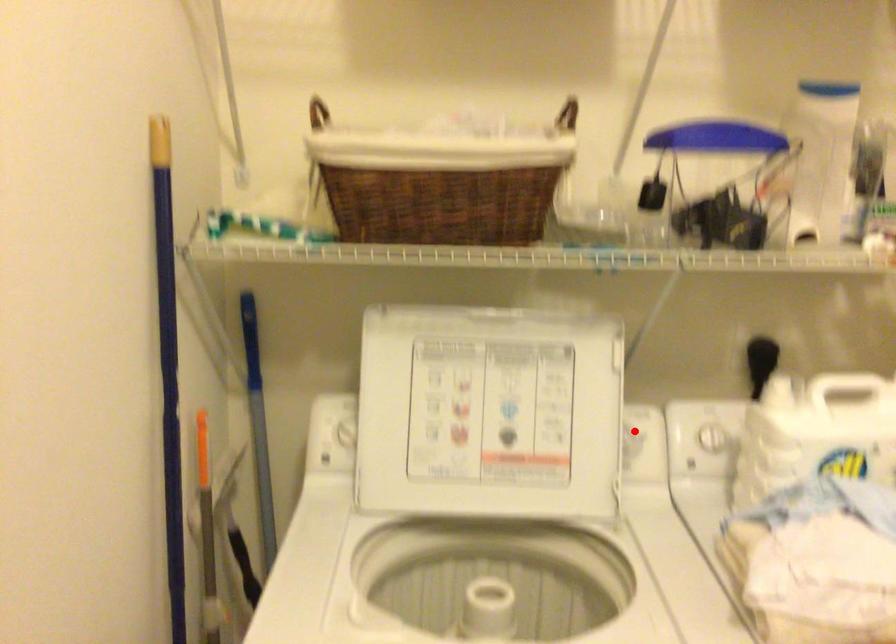
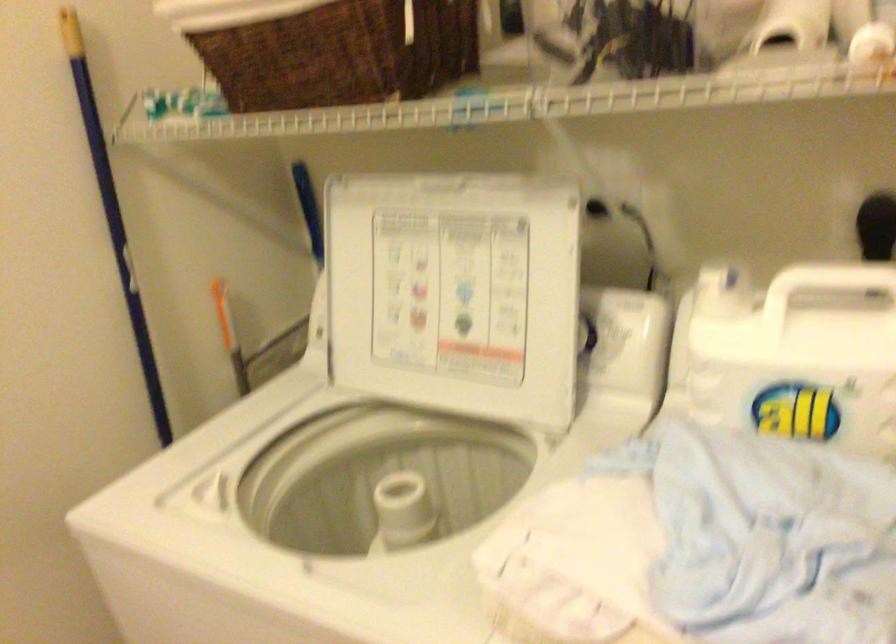
Question: I am providing you with two images of the same scene from different viewpoints. A red point is shown in image1. For the corresponding object point in image2, is it positioned nearer or farther from the camera?

Choices:
 (A) Nearer
 (B) Farther

Answer: (A)